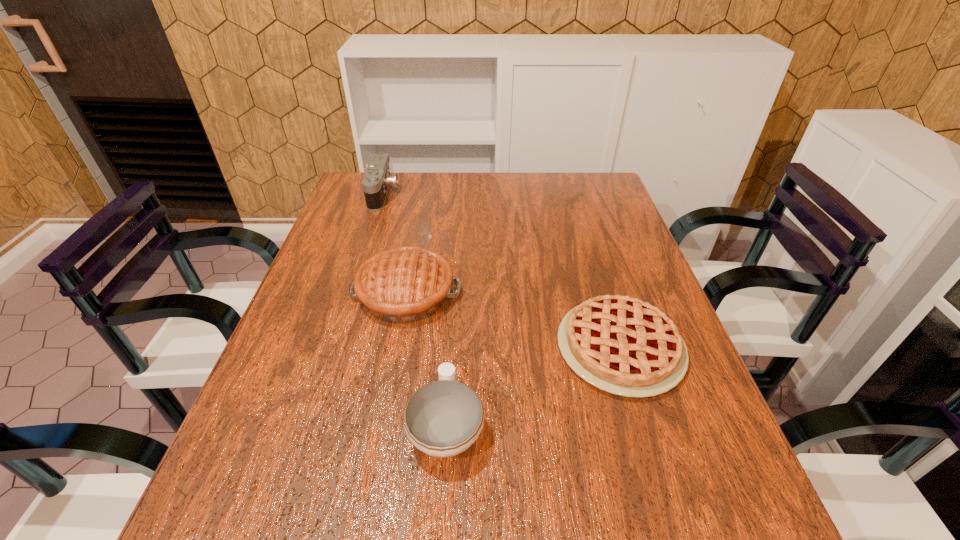
Image resolution: width=960 pixels, height=540 pixels. Identify the location of vacant point that satisfies the following two spatial constraints: 1. on the side with the handle of the chinaware; 2. on the lens of the farthest object. (461, 194).